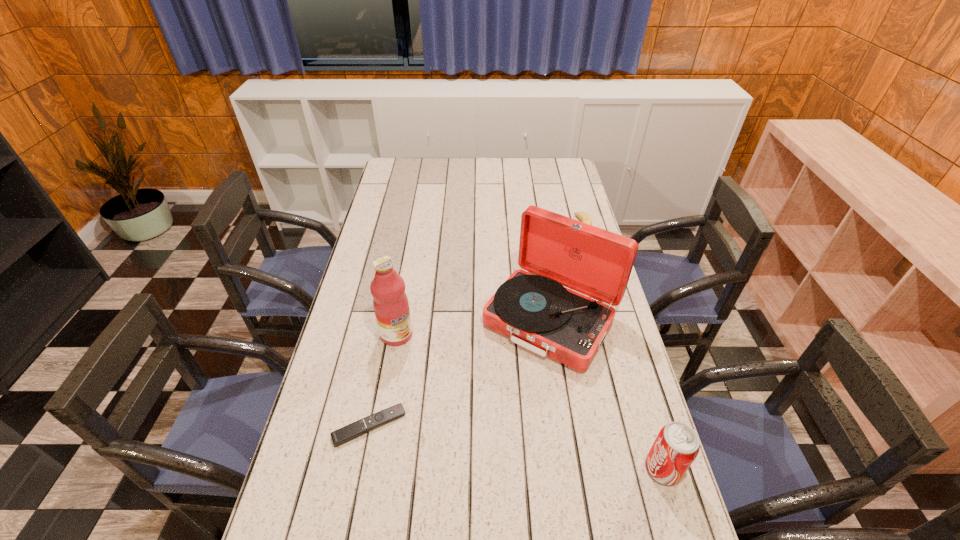
At what (x,y) coordinates should I click in order to perform the action: click on vacant space located 0.330m on the front-facing side of the phonograph_record. Please return your answer as a coordinate pair (x, y). Looking at the image, I should click on (452, 458).

Find the location of a particular element. Image resolution: width=960 pixels, height=540 pixels. vacant space located on the front-facing side of the phonograph_record is located at coordinates (481, 418).

I want to click on free space located 0.380m on the front-facing side of the phonograph_record, so click(x=441, y=475).

Locate an element on the screen. This screenshot has width=960, height=540. free space located 0.260m on the label of the fruit juice is located at coordinates (455, 404).

Identify the location of free space located on the label of the fruit juice. The width and height of the screenshot is (960, 540). (460, 409).

Locate an element on the screen. The image size is (960, 540). free space located on the label of the fruit juice is located at coordinates (453, 401).

Identify the location of vacant region located 0.390m at the stem of the banana. The width and height of the screenshot is (960, 540). (540, 304).

The image size is (960, 540). I want to click on vacant space situated at the stem of the banana, so click(555, 273).

Image resolution: width=960 pixels, height=540 pixels. In order to click on vacant region located at the stem of the banana in this screenshot , I will do `click(540, 304)`.

What are the coordinates of `remote control that is at the left edge` in the screenshot? It's located at (349, 432).